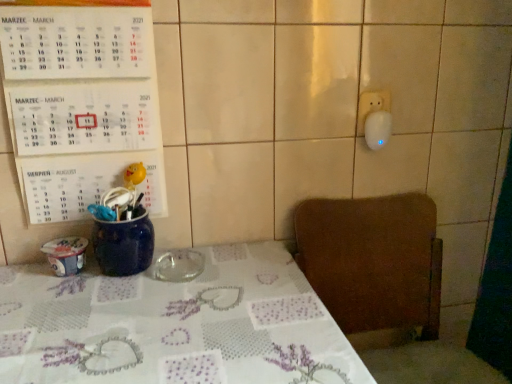
Question: From a real-world perspective, is transparent glass ashtray at center physically below white paper calendar at upper left?

Choices:
 (A) yes
 (B) no

Answer: (A)

Question: Is transparent glass ashtray at center facing towards white paper calendar at upper left?

Choices:
 (A) no
 (B) yes

Answer: (A)

Question: Does transparent glass ashtray at center have a lesser width compared to white paper calendar at upper left?

Choices:
 (A) yes
 (B) no

Answer: (B)

Question: Is transparent glass ashtray at center positioned far away from white paper calendar at upper left?

Choices:
 (A) no
 (B) yes

Answer: (A)

Question: Is transparent glass ashtray at center at the right side of white paper calendar at upper left?

Choices:
 (A) yes
 (B) no

Answer: (A)

Question: From their relative heights in the image, would you say white paper calendar at upper left is taller or shorter than transparent glass ashtray at center?

Choices:
 (A) tall
 (B) short

Answer: (A)

Question: Is white paper calendar at upper left spatially inside transparent glass ashtray at center, or outside of it?

Choices:
 (A) inside
 (B) outside

Answer: (B)

Question: From the image's perspective, is white paper calendar at upper left above or below transparent glass ashtray at center?

Choices:
 (A) above
 (B) below

Answer: (A)

Question: Based on their positions, is white paper calendar at upper left located to the left or right of transparent glass ashtray at center?

Choices:
 (A) right
 (B) left

Answer: (B)

Question: From a real-world perspective, is brown wooden chair at lower right physically located above or below white paper calendar at upper left?

Choices:
 (A) below
 (B) above

Answer: (A)

Question: Based on their sizes in the image, would you say brown wooden chair at lower right is bigger or smaller than white paper calendar at upper left?

Choices:
 (A) small
 (B) big

Answer: (B)

Question: Relative to white paper calendar at upper left, is brown wooden chair at lower right in front or behind?

Choices:
 (A) behind
 (B) front

Answer: (B)

Question: Does point (374, 211) appear closer or farther from the camera than point (110, 129)?

Choices:
 (A) closer
 (B) farther

Answer: (B)

Question: Is transparent glass ashtray at center to the left or to the right of white paper calendar at upper left in the image?

Choices:
 (A) left
 (B) right

Answer: (B)

Question: From the image's perspective, is transparent glass ashtray at center above or below white paper calendar at upper left?

Choices:
 (A) above
 (B) below

Answer: (B)